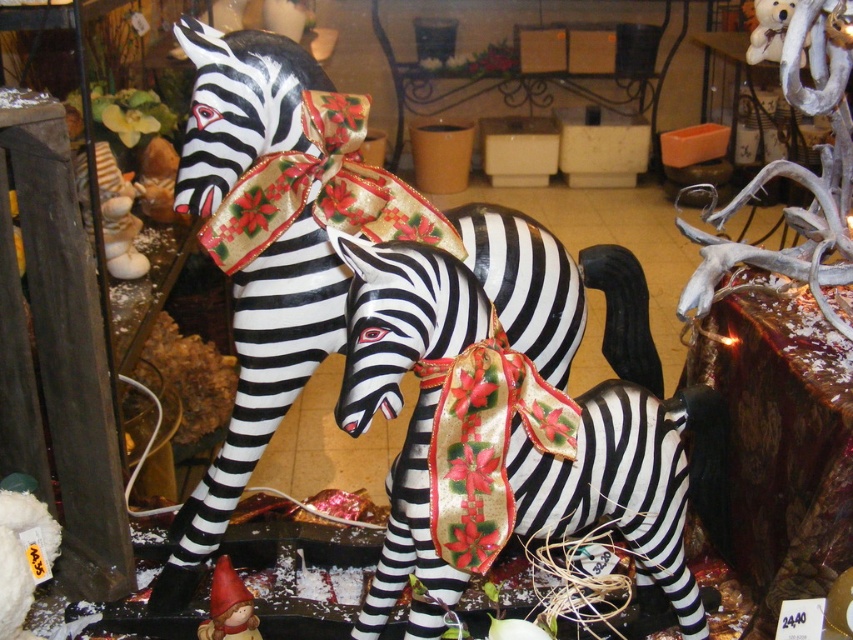
Question: Can you confirm if shiny black and white striped zebra at center is positioned below black and white striped zebra at center?

Choices:
 (A) yes
 (B) no

Answer: (A)

Question: Which object appears farthest from the camera in this image?

Choices:
 (A) black and white striped zebra at center
 (B) matte plastic gnome at lower left

Answer: (A)

Question: Which of these objects is positioned closest to the black and white striped zebra at center?

Choices:
 (A) matte plastic gnome at lower left
 (B) shiny black and white striped zebra at center

Answer: (B)

Question: Considering the relative positions of shiny black and white striped zebra at center and matte plastic gnome at lower left in the image provided, where is shiny black and white striped zebra at center located with respect to matte plastic gnome at lower left?

Choices:
 (A) above
 (B) below

Answer: (A)

Question: Among these points, which one is nearest to the camera?

Choices:
 (A) (393, 248)
 (B) (206, 632)
 (C) (466, 227)

Answer: (A)

Question: Is shiny black and white striped zebra at center positioned at the back of black and white striped zebra at center?

Choices:
 (A) no
 (B) yes

Answer: (A)